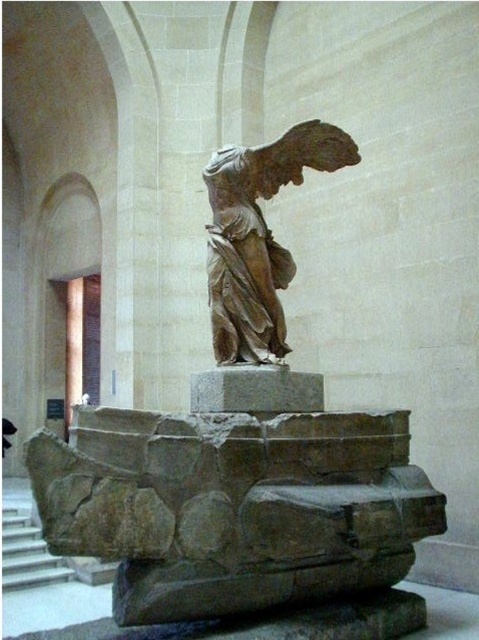
Does matte bronze statue at center have a lesser width compared to white marble stairs at lower left?

Yes, matte bronze statue at center is thinner than white marble stairs at lower left.

Is matte bronze statue at center positioned in front of white marble stairs at lower left?

Yes, it is in front of white marble stairs at lower left.

Is point (255, 161) farther from viewer compared to point (26, 522)?

No, it is not.

At what (x,y) coordinates should I click in order to perform the action: click on matte bronze statue at center. Please return your answer as a coordinate pair (x, y). The width and height of the screenshot is (479, 640). Looking at the image, I should click on (259, 236).